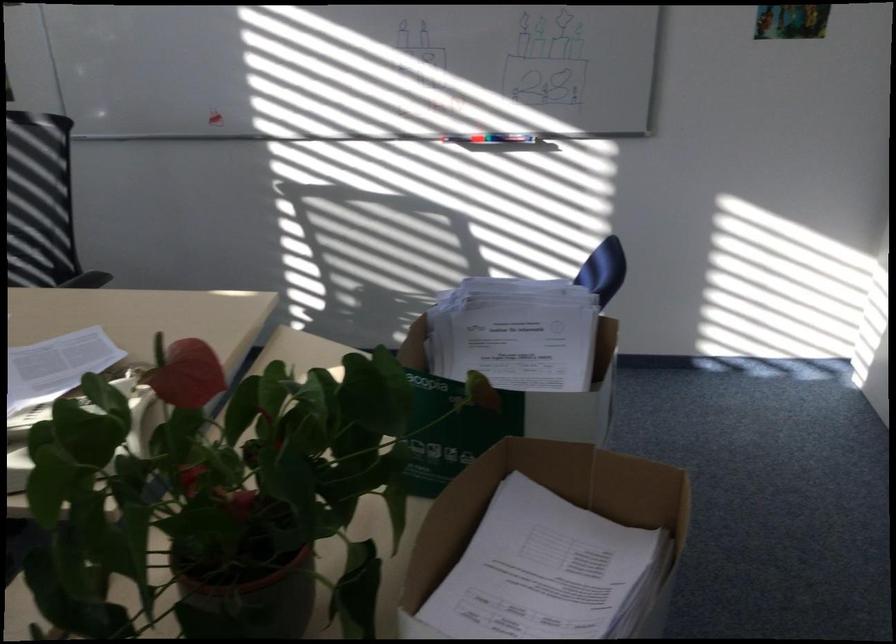
Locate an element on the screen. The width and height of the screenshot is (896, 644). blue ribbon is located at coordinates (604, 267).